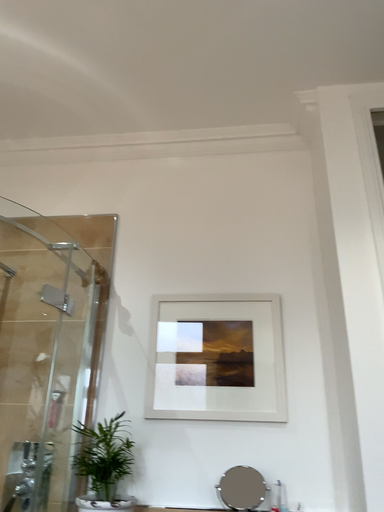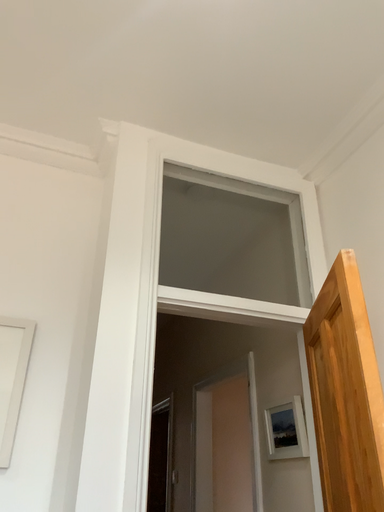
Question: Which way did the camera rotate in the video?

Choices:
 (A) rotated right
 (B) rotated left

Answer: (A)